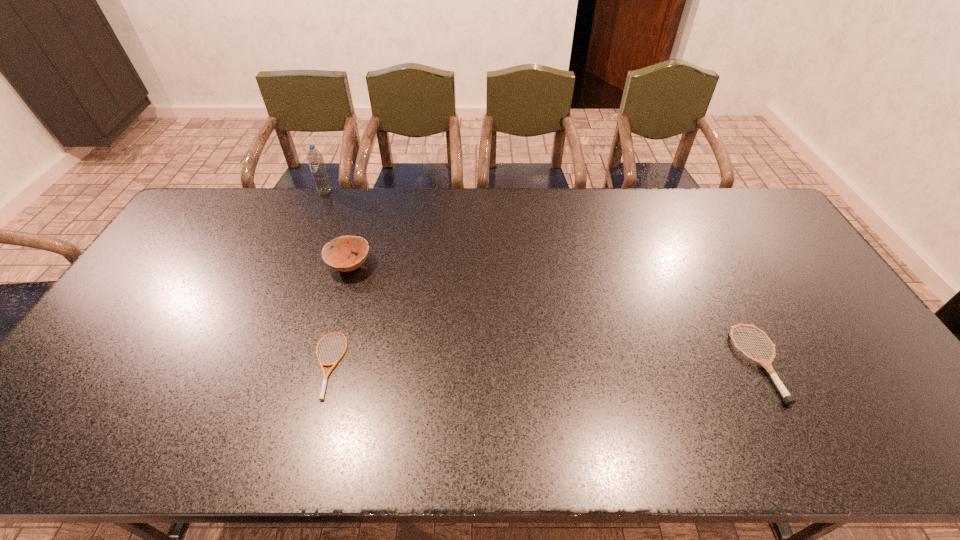
Locate an element on the screen. Image resolution: width=960 pixels, height=540 pixels. vacant space located on the left of the rightmost object is located at coordinates (612, 363).

At what (x,y) coordinates should I click in order to perform the action: click on vacant area situated 0.100m on the front of the shortest object. Please return your answer as a coordinate pair (x, y). This screenshot has height=540, width=960. Looking at the image, I should click on (306, 441).

The image size is (960, 540). In order to click on object present at the far edge in this screenshot , I will do `click(315, 159)`.

Where is `free space at the far edge of the desktop`? This screenshot has width=960, height=540. free space at the far edge of the desktop is located at coordinates (667, 194).

Find the location of a particular element. The height and width of the screenshot is (540, 960). blank space at the near edge of the desktop is located at coordinates (857, 443).

The image size is (960, 540). I want to click on vacant space at the left edge of the desktop, so (141, 289).

Locate an element on the screen. vacant space at the right edge is located at coordinates (755, 239).

The height and width of the screenshot is (540, 960). What are the coordinates of `blank space at the far left corner` in the screenshot? It's located at (188, 225).

Where is `blank area at the near left corner`? blank area at the near left corner is located at coordinates (95, 442).

The image size is (960, 540). I want to click on blank region between the rightmost object and the third nearest object, so point(555,314).